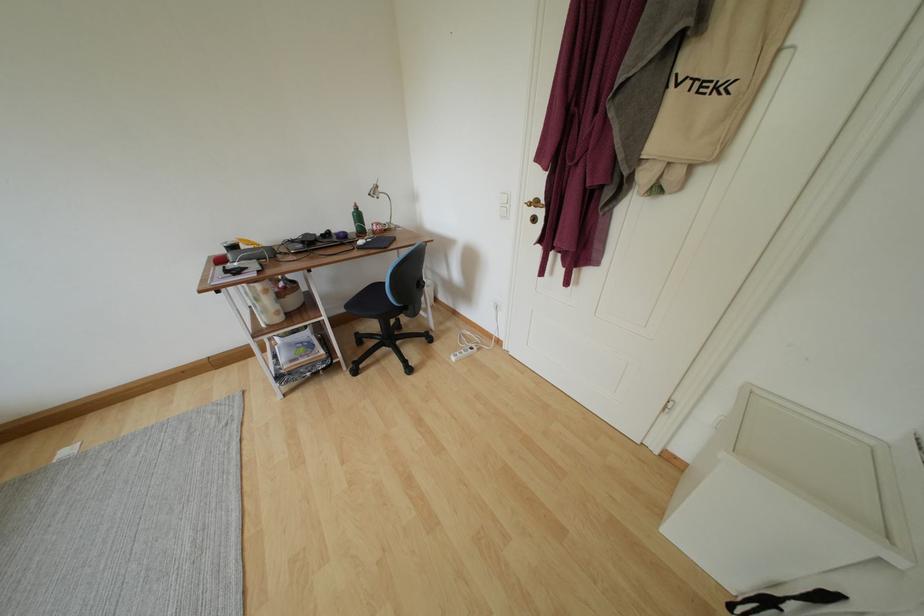
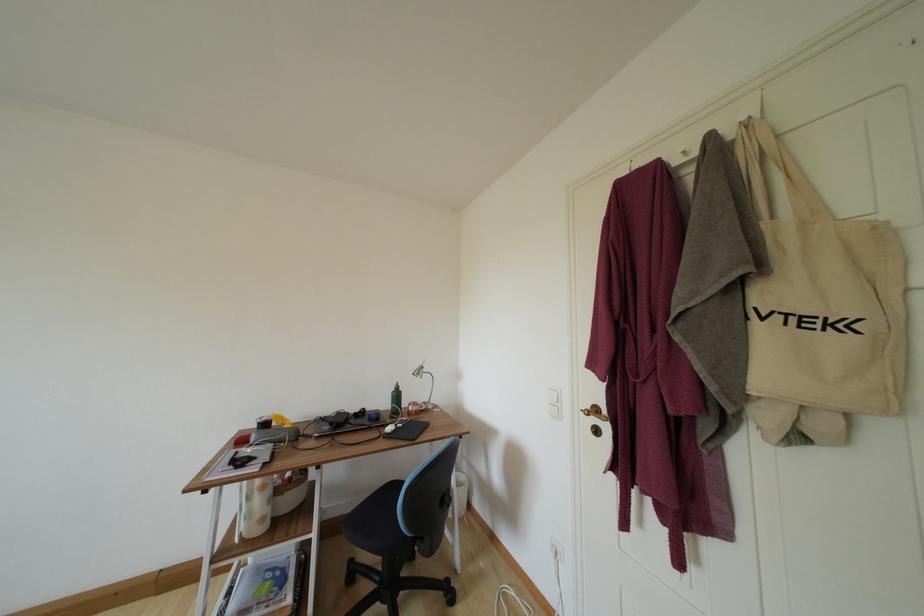
Find the pixel in the second image that matches pixel 333 238 in the first image.

(367, 416)